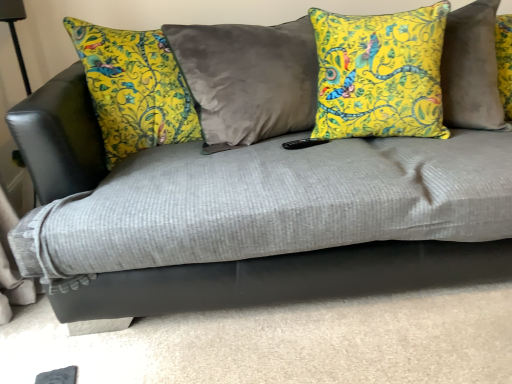
The width and height of the screenshot is (512, 384). I want to click on yellow fabric pillow at center, so click(x=380, y=74).

Image resolution: width=512 pixels, height=384 pixels. What do you see at coordinates (380, 74) in the screenshot? I see `yellow fabric pillow at center` at bounding box center [380, 74].

Locate an element on the screen. Image resolution: width=512 pixels, height=384 pixels. yellow fabric pillow at center is located at coordinates (380, 74).